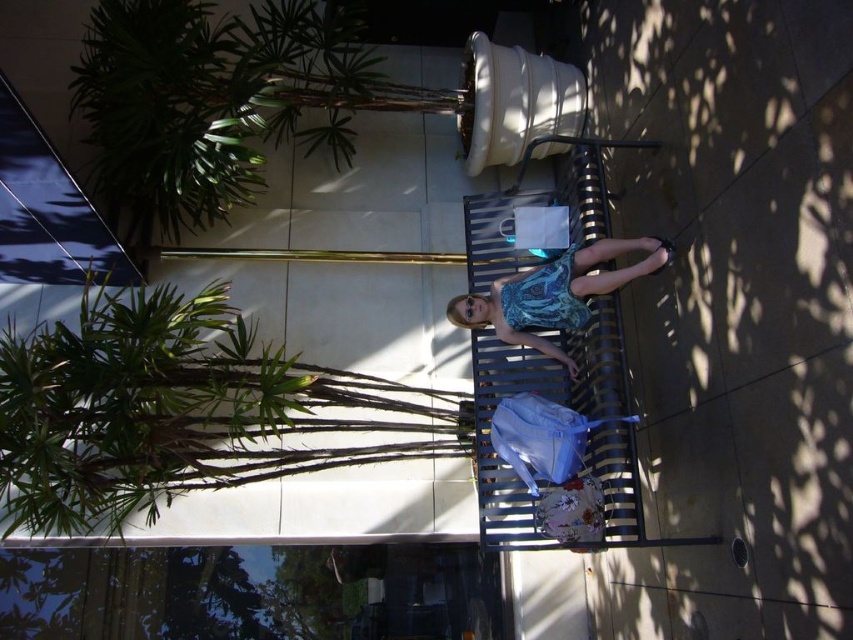
Question: Can you confirm if printed fabric dress at center is wider than blue patterned fabric dress at center?

Choices:
 (A) no
 (B) yes

Answer: (B)

Question: Which point is farther from the camera taking this photo?

Choices:
 (A) (566, 257)
 (B) (532, 316)

Answer: (B)

Question: In this image, where is printed fabric dress at center located relative to blue patterned fabric dress at center?

Choices:
 (A) right
 (B) left

Answer: (A)

Question: Which object appears closest to the camera in this image?

Choices:
 (A) printed fabric dress at center
 (B) blue patterned fabric dress at center

Answer: (A)

Question: Which point appears farthest from the camera in this image?

Choices:
 (A) (546, 307)
 (B) (526, 288)

Answer: (B)

Question: Is printed fabric dress at center in front of blue patterned fabric dress at center?

Choices:
 (A) yes
 (B) no

Answer: (A)